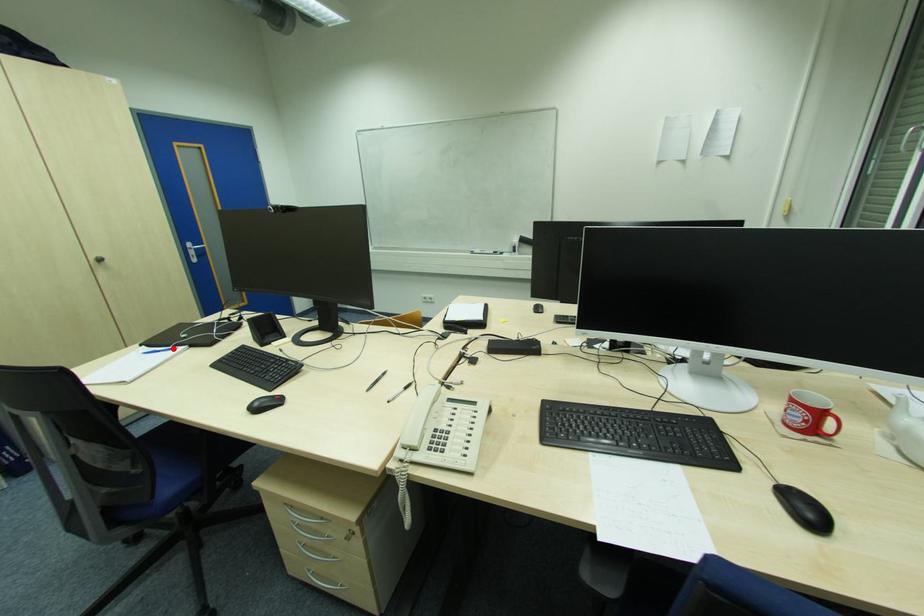
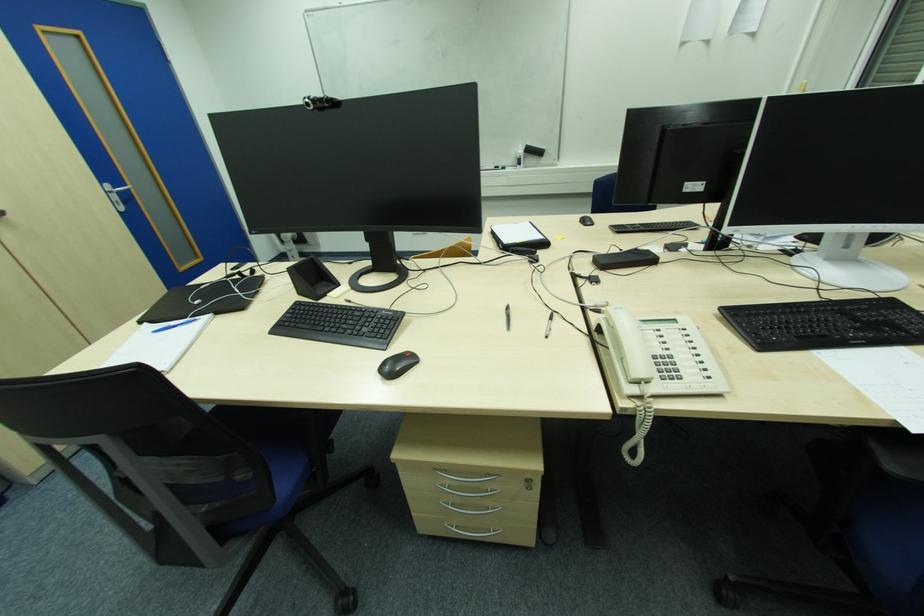
Find the pixel in the second image that matches the highlighted location in the first image.

(190, 320)